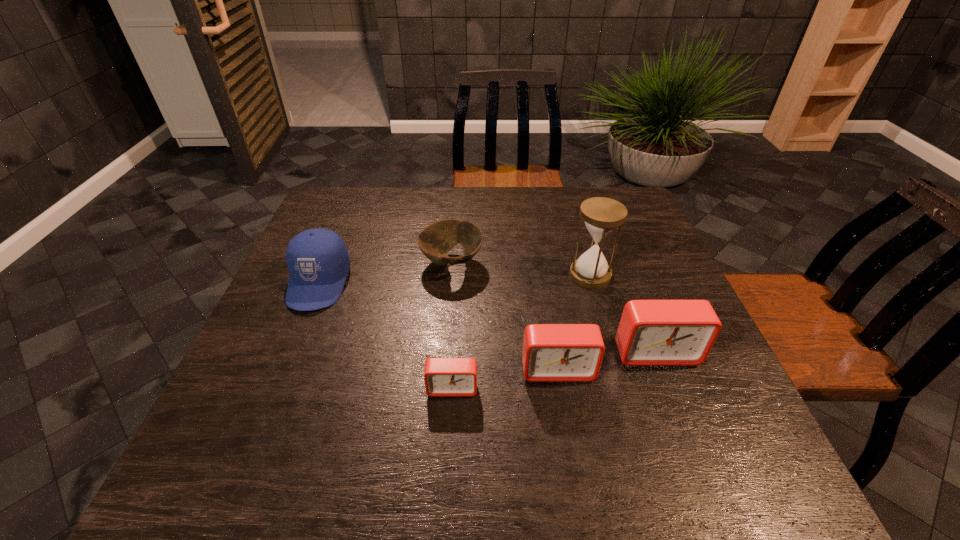
Image resolution: width=960 pixels, height=540 pixels. In order to click on the third closest alarm clock to the hourglass in this screenshot , I will do `click(443, 376)`.